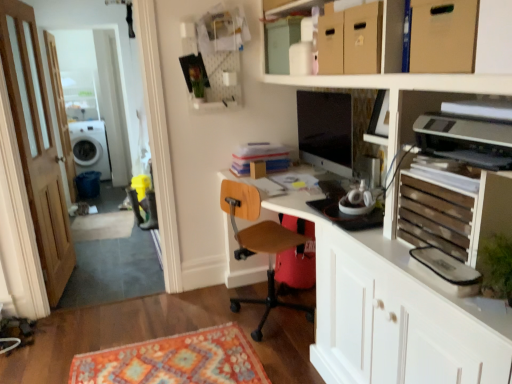
Question: Is point (417, 187) closer or farther from the camera than point (67, 119)?

Choices:
 (A) farther
 (B) closer

Answer: (B)

Question: In terms of height, does wooden slats at right look taller or shorter compared to brown wooden screen door at left?

Choices:
 (A) short
 (B) tall

Answer: (A)

Question: Estimate the real-world distances between objects in this image. Which object is farther from the matte black monitor at center?

Choices:
 (A) wooden door at left
 (B) cardboard box at upper right
 (C) brown wooden screen door at left
 (D) wooden at center
 (E) wooden slats at right

Answer: (C)

Question: Based on their relative distances, which object is farther from the cardboard box at upper right?

Choices:
 (A) matte black monitor at center
 (B) wooden slats at right
 (C) wooden at center
 (D) white glossy washing machine at left
 (E) white glossy entertainment center at upper center

Answer: (D)